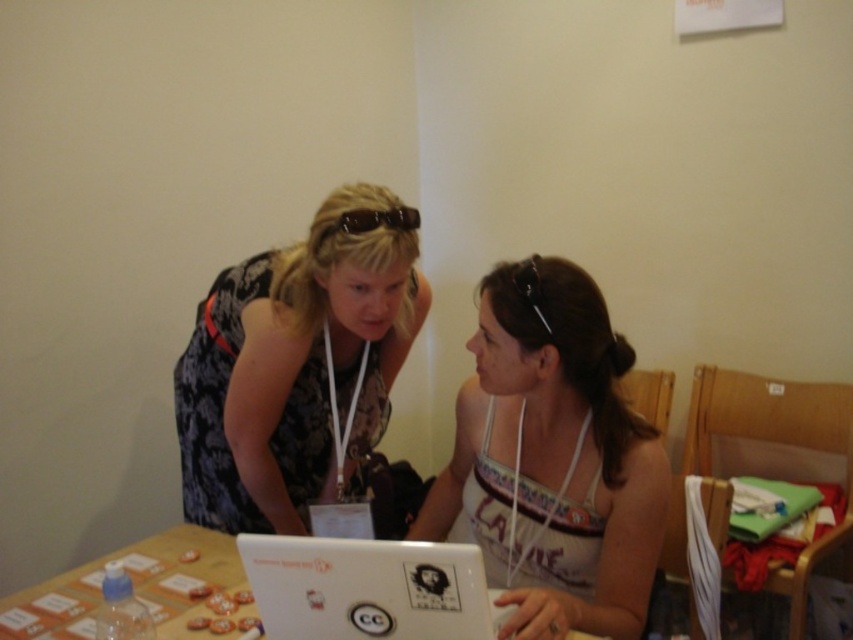
You are a photographer setting up a shoot at the scene described. You need to place a small microphone between the floral dress at center and the white glossy laptop at center. Based on their positions, which side of the laptop should you place the microphone to ensure it is between them?

The floral dress at center is positioned on the left side of the white glossy laptop at center, so placing the microphone to the left side of the laptop would position it between the two objects.

You are taking a photo of the two women at the table. The woman on the left has a lanyard around her neck, and the woman on the right is wearing a white tank top. You want to ensure both points, point [302,609] and point [376,221], are in focus. Which point should you focus on to ensure both are sharp?

You should focus on point [376,221] because it is farther from the camera, and focusing on the farther point will ensure both points are in focus.

You are a person who needs to pass a notebook from the woman on the left to the woman on the right at the table. The notebook is placed on the white glossy laptop at center. Can you reach the woman on the right without moving from your current position?

The women are 37.91 inches apart. The average human arm span is about 30 inches. Since the distance between them is greater than the average arm span, you cannot reach the woman on the right without moving from your current position.